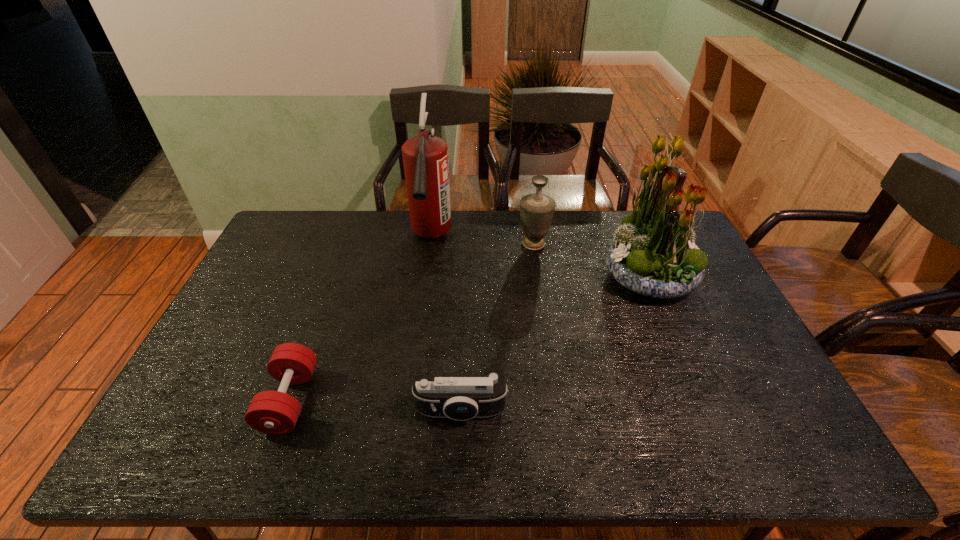
Find the location of `fire extinguisher`. fire extinguisher is located at coordinates (425, 158).

Where is `flower arrangement`? This screenshot has width=960, height=540. flower arrangement is located at coordinates (653, 254).

Find the location of a particular element. This screenshot has width=960, height=540. the third tallest object is located at coordinates (536, 210).

Locate an element on the screen. This screenshot has height=540, width=960. urn is located at coordinates (536, 210).

Identify the location of camera. The width and height of the screenshot is (960, 540). (460, 397).

Locate an element on the screen. Image resolution: width=960 pixels, height=540 pixels. the shortest object is located at coordinates (272, 412).

This screenshot has width=960, height=540. Identify the location of the leftmost object. (272, 412).

I want to click on vacant region located at the nozzle of the fire extinguisher, so click(420, 316).

Find the location of a particular element. Image resolution: width=960 pixels, height=540 pixels. vacant space located 0.360m on the front-facing side of the flower arrangement is located at coordinates (492, 278).

Locate an element on the screen. free location located on the front-facing side of the flower arrangement is located at coordinates (482, 278).